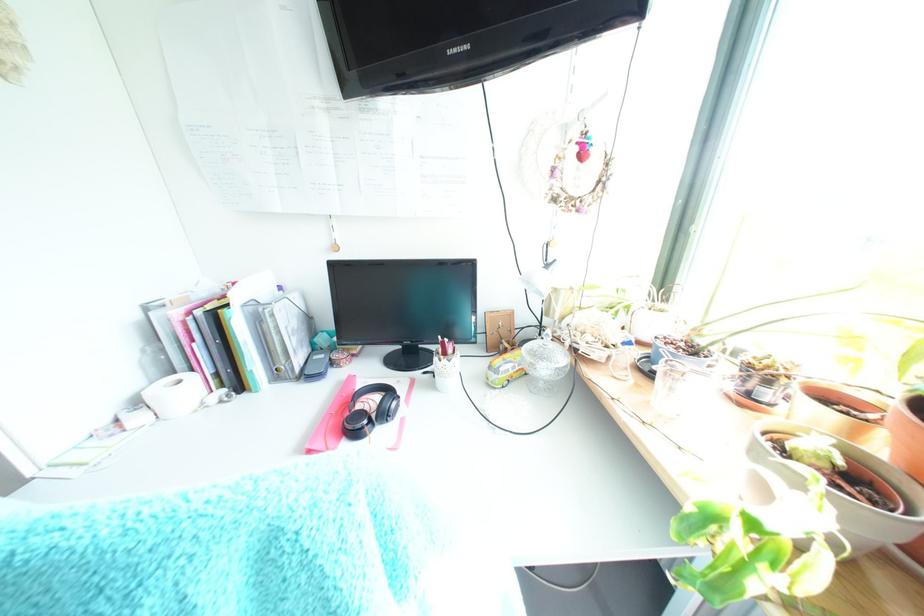
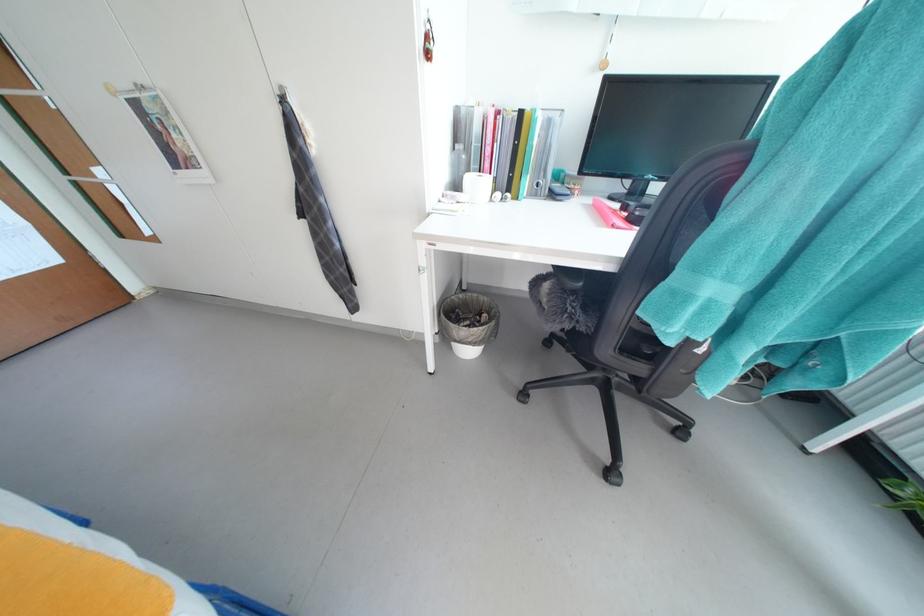
Which direction would the cameraman need to move to produce the second image?

The cameraman moved toward left, backward.